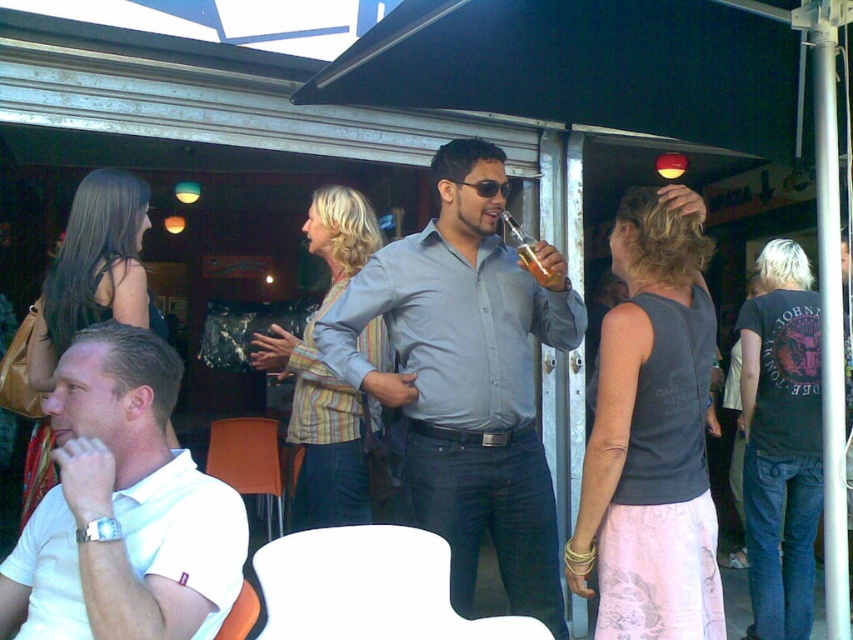
From the picture: You are standing at the position of the man holding the beer bottle. You want to take a photo of both the point at coordinates point (549,344) and point (817,438). Which point will appear larger in the photo?

Point (549,344) will appear larger in the photo because it is closer to the camera than point (817,438).